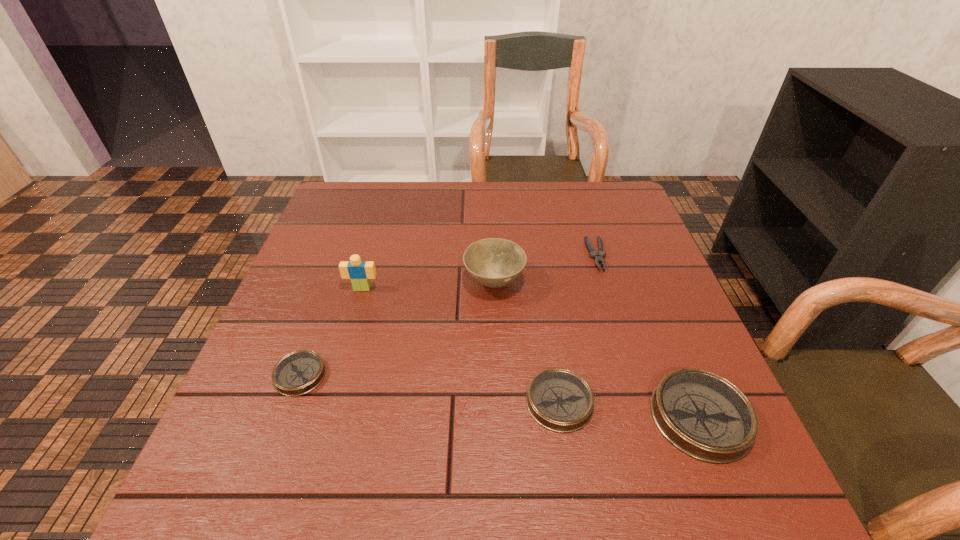
This screenshot has width=960, height=540. Identify the location of the shortest compass. (297, 373).

Find the location of `the second shortest object`. the second shortest object is located at coordinates (297, 373).

Image resolution: width=960 pixels, height=540 pixels. In order to click on the second compass from right to left in this screenshot , I will do `click(560, 400)`.

Locate an element on the screen. The width and height of the screenshot is (960, 540). the third shortest object is located at coordinates (560, 400).

Where is `the third tallest object`? The height and width of the screenshot is (540, 960). the third tallest object is located at coordinates (703, 415).

Identify the location of the rightmost compass. The width and height of the screenshot is (960, 540). pos(703,415).

Image resolution: width=960 pixels, height=540 pixels. I want to click on pliers, so click(598, 257).

This screenshot has width=960, height=540. I want to click on the second tallest object, so click(x=493, y=262).

Find the location of a particular element. the tallest object is located at coordinates (359, 272).

Where is `free space located on the right of the fifth tallest object`? free space located on the right of the fifth tallest object is located at coordinates [356, 375].